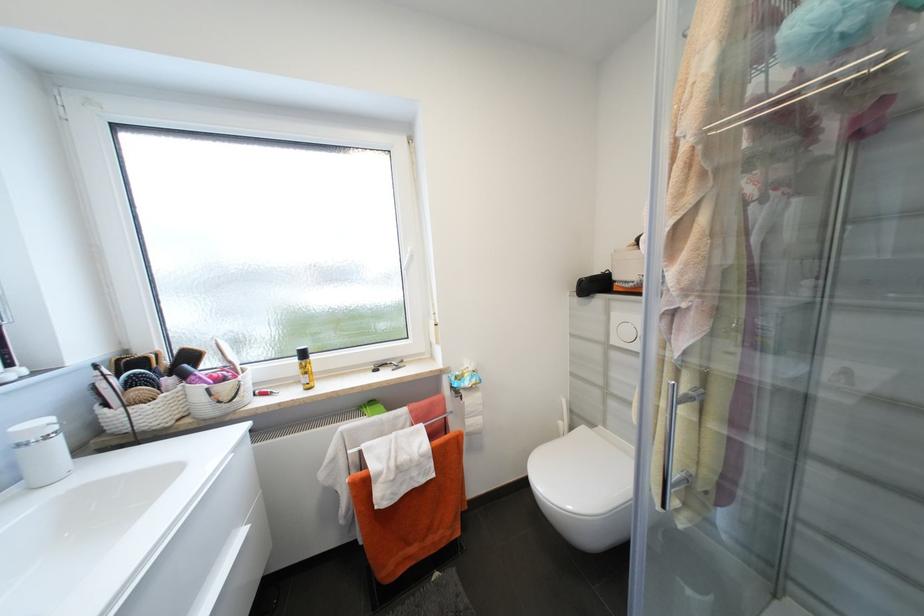
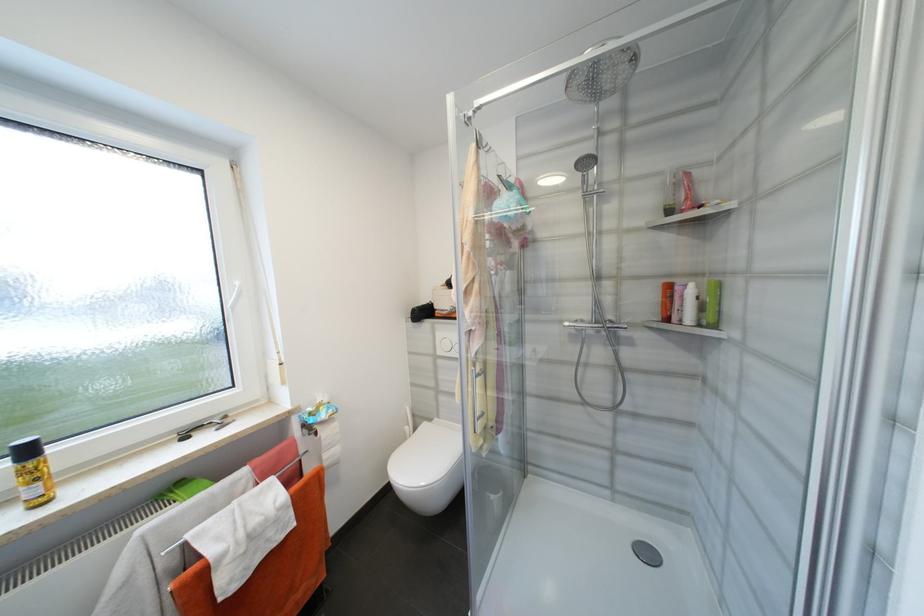
In the second image, find the point that corresponds to the point at 310,355 in the first image.

(33, 453)